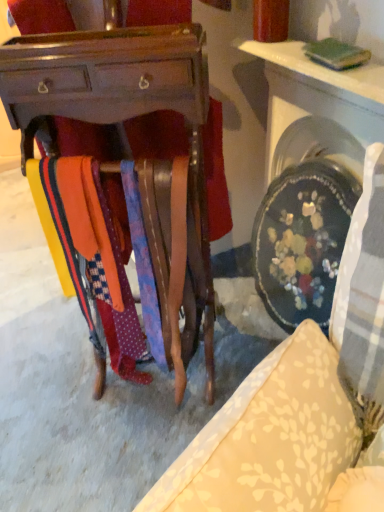
Question: From the image's perspective, does orange fabric at center appear lower than polka dot fabric tie at center?

Choices:
 (A) yes
 (B) no

Answer: (A)

Question: Is orange fabric at center not inside polka dot fabric tie at center?

Choices:
 (A) no
 (B) yes

Answer: (B)

Question: Considering the relative positions of orange fabric at center and polka dot fabric tie at center in the image provided, is orange fabric at center to the right of polka dot fabric tie at center from the viewer's perspective?

Choices:
 (A) yes
 (B) no

Answer: (B)

Question: Can you confirm if orange fabric at center is bigger than polka dot fabric tie at center?

Choices:
 (A) yes
 (B) no

Answer: (A)

Question: Considering the relative sizes of orange fabric at center and polka dot fabric tie at center in the image provided, is orange fabric at center shorter than polka dot fabric tie at center?

Choices:
 (A) no
 (B) yes

Answer: (A)

Question: Is orange fabric at center far from polka dot fabric tie at center?

Choices:
 (A) no
 (B) yes

Answer: (A)

Question: From a real-world perspective, is wooden tie rack at center under polka dot fabric tie at center?

Choices:
 (A) yes
 (B) no

Answer: (A)

Question: Does wooden tie rack at center have a greater width compared to polka dot fabric tie at center?

Choices:
 (A) no
 (B) yes

Answer: (B)

Question: Is wooden tie rack at center closer to camera compared to polka dot fabric tie at center?

Choices:
 (A) no
 (B) yes

Answer: (A)

Question: Is wooden tie rack at center at the right side of polka dot fabric tie at center?

Choices:
 (A) no
 (B) yes

Answer: (A)

Question: Considering the relative sizes of wooden tie rack at center and polka dot fabric tie at center in the image provided, is wooden tie rack at center bigger than polka dot fabric tie at center?

Choices:
 (A) no
 (B) yes

Answer: (B)

Question: Is wooden tie rack at center located outside polka dot fabric tie at center?

Choices:
 (A) no
 (B) yes

Answer: (B)

Question: Would you say wooden desk at center is outside wooden tie rack at center?

Choices:
 (A) yes
 (B) no

Answer: (A)